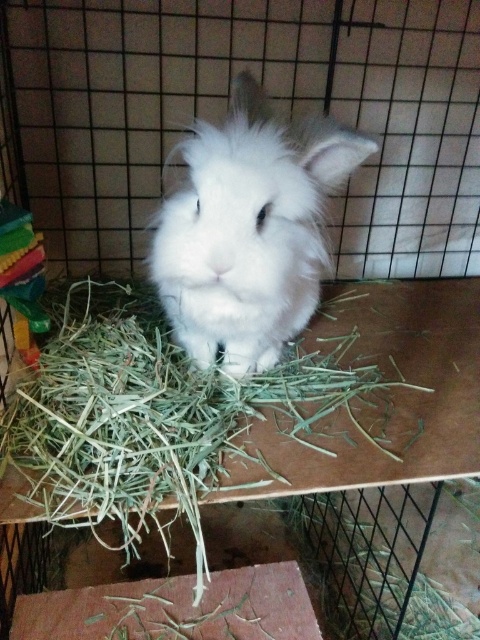
Who is shorter, green straw at center or white fluffy rabbit at center?

Standing shorter between the two is green straw at center.

Is the position of green straw at center more distant than that of white fluffy rabbit at center?

That is False.

Who is more distant from viewer, (197, 385) or (255, 260)?

The point (197, 385) is more distant.

Locate an element on the screen. This screenshot has height=640, width=480. green straw at center is located at coordinates (148, 416).